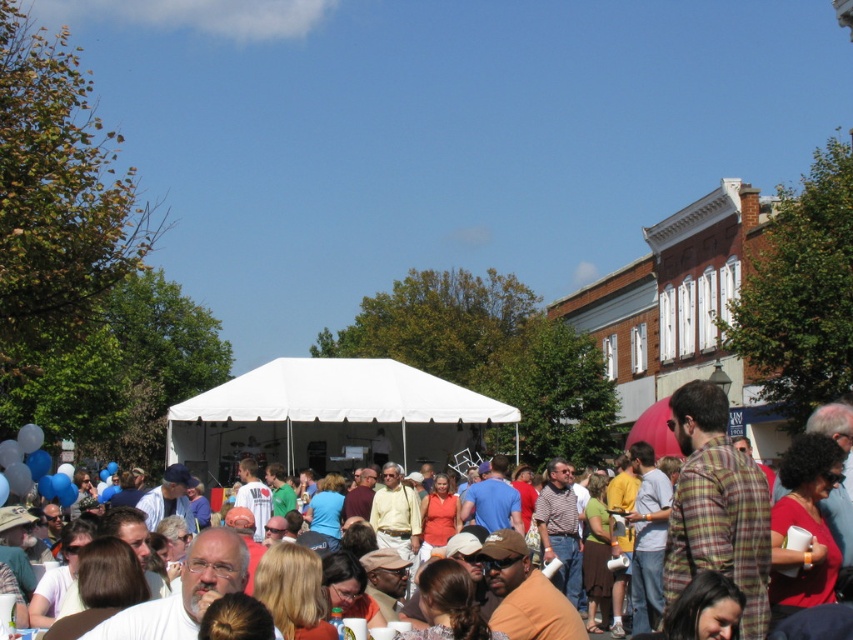
Question: Which point is closer to the camera taking this photo?

Choices:
 (A) (309, 451)
 (B) (676, 492)

Answer: (B)

Question: Can you confirm if white fabric canopy at center is wider than white tent at center?

Choices:
 (A) yes
 (B) no

Answer: (A)

Question: Can you confirm if white fabric canopy at center is wider than white tent at center?

Choices:
 (A) yes
 (B) no

Answer: (A)

Question: Observing the image, what is the correct spatial positioning of white fabric canopy at center in reference to white tent at center?

Choices:
 (A) below
 (B) above

Answer: (B)